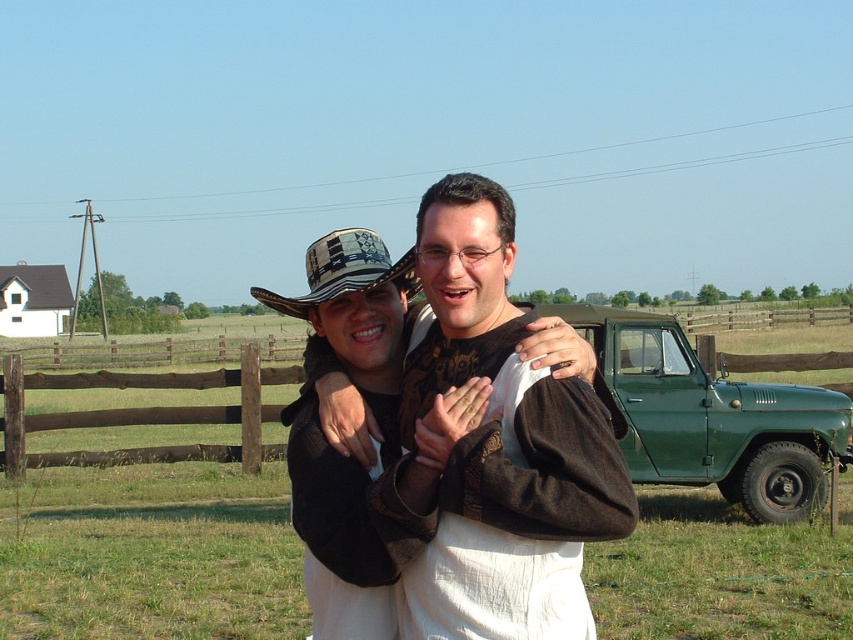
In the scene shown: Does white cotton shirt at center have a greater height compared to brown wooden fence at left?

Incorrect, white cotton shirt at center's height is not larger of brown wooden fence at left's.

Is point (486, 616) positioned after point (28, 428)?

No, (486, 616) is closer to viewer.

This screenshot has width=853, height=640. What are the coordinates of `white cotton shirt at center` in the screenshot? It's located at (497, 444).

Where is `white cotton shirt at center`? white cotton shirt at center is located at coordinates (497, 444).

Can you confirm if green matte pickup truck at right is smaller than brown wooden fence at left?

Yes.

Does green matte pickup truck at right come behind brown wooden fence at left?

No.

Is point (315, 358) in front of point (112, 416)?

Yes, it is in front of point (112, 416).

At what (x,y) coordinates should I click in order to perform the action: click on green matte pickup truck at right. Please return your answer as a coordinate pair (x, y). Looking at the image, I should click on (711, 417).

Which is in front, point (735, 486) or point (288, 301)?

Point (288, 301) is in front.

Can you confirm if green matte pickup truck at right is positioned to the left of patterned fabric cowboy hat at center?

No, green matte pickup truck at right is not to the left of patterned fabric cowboy hat at center.

Locate an element on the screen. This screenshot has width=853, height=640. green matte pickup truck at right is located at coordinates (711, 417).

I want to click on green matte pickup truck at right, so click(x=711, y=417).